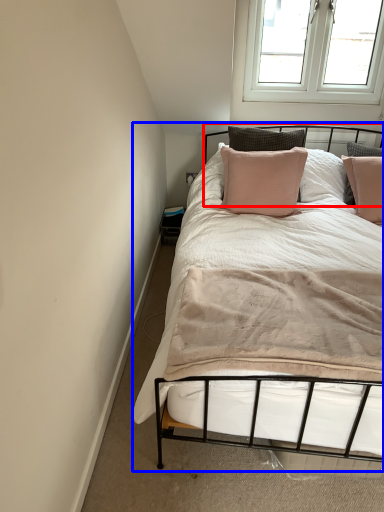
Question: Which of the following is the farthest to the observer, headboard (highlighted by a red box) or bed (highlighted by a blue box)?

Choices:
 (A) headboard
 (B) bed

Answer: (A)